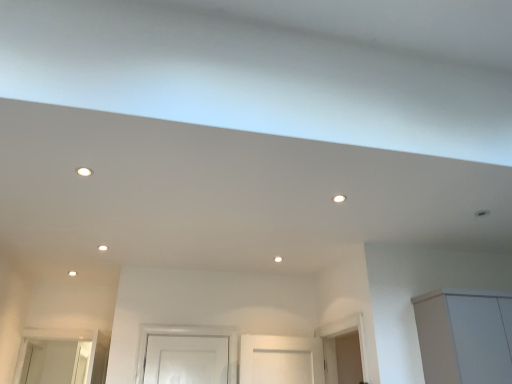
Question: Considering the positions of white matte cabinet at lower right and matte white light fixture at center, placed as the 2th lighting when sorted from left to right, in the image, is white matte cabinet at lower right bigger or smaller than matte white light fixture at center, placed as the 2th lighting when sorted from left to right,?

Choices:
 (A) small
 (B) big

Answer: (B)

Question: From the image's perspective, relative to matte white light fixture at center, positioned as the first lighting in bottom-to-top order, is white matte cabinet at lower right above or below?

Choices:
 (A) above
 (B) below

Answer: (B)

Question: Considering the real-world distances, which object is closest to the matte white light fixture at center, positioned as the first lighting in bottom-to-top order?

Choices:
 (A) white matte cabinet at lower right
 (B) white glossy light fixture at upper left, arranged as the first lighting when viewed from the left

Answer: (A)

Question: Which object is the farthest from the white matte cabinet at lower right?

Choices:
 (A) matte white light fixture at center, positioned as the first lighting in bottom-to-top order
 (B) white glossy light fixture at upper left, the second lighting in the bottom-to-top sequence

Answer: (B)